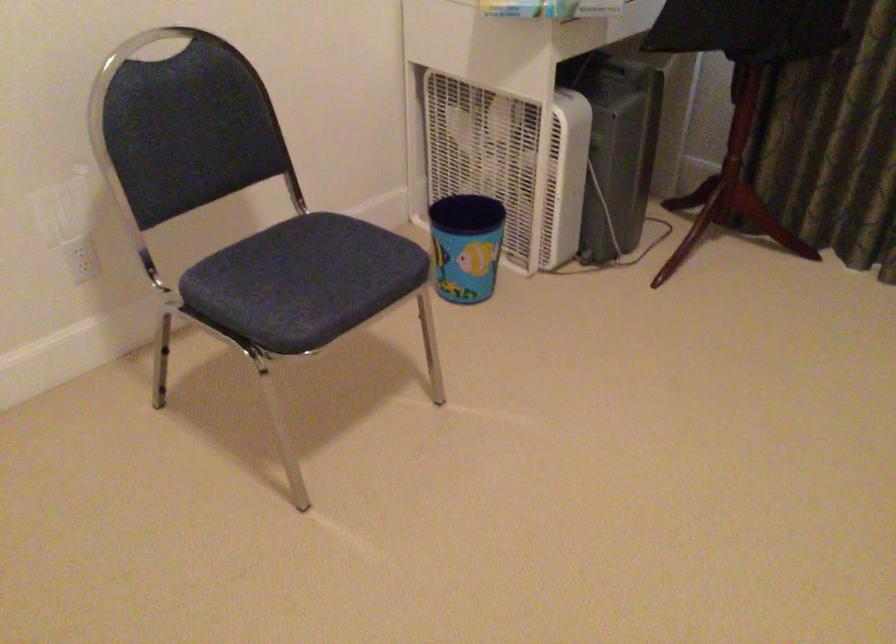
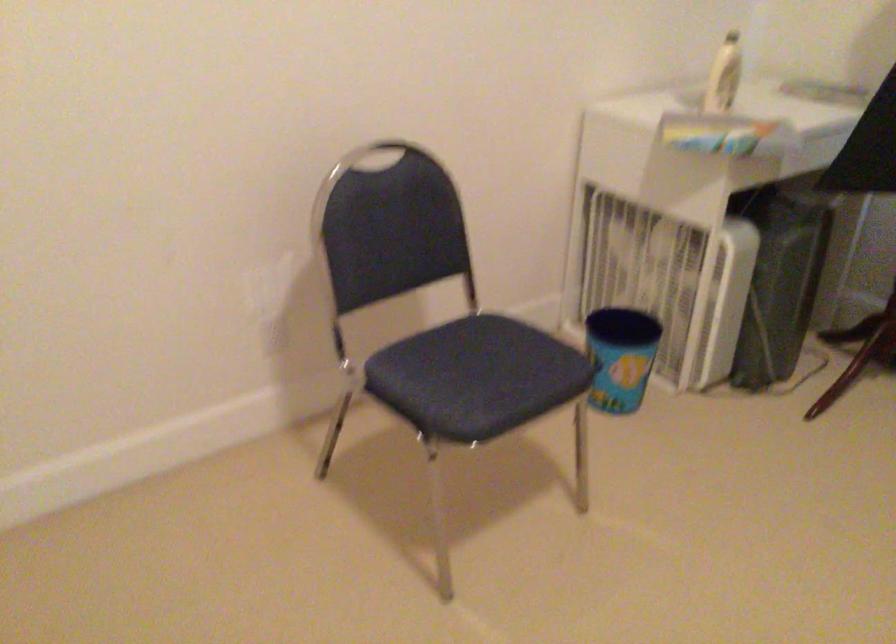
Where in the second image is the point corresponding to the point at 463,243 from the first image?

(619, 357)